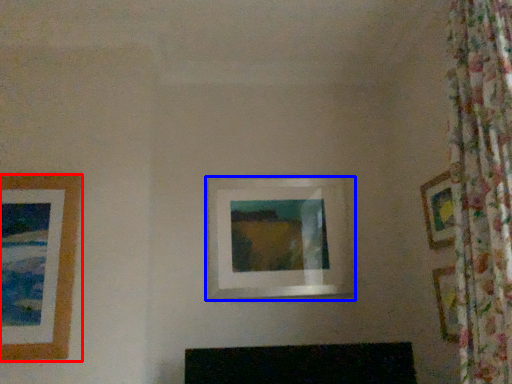
Question: Which object appears farthest to the camera in this image, picture frame (highlighted by a red box) or picture frame (highlighted by a blue box)?

Choices:
 (A) picture frame
 (B) picture frame

Answer: (B)